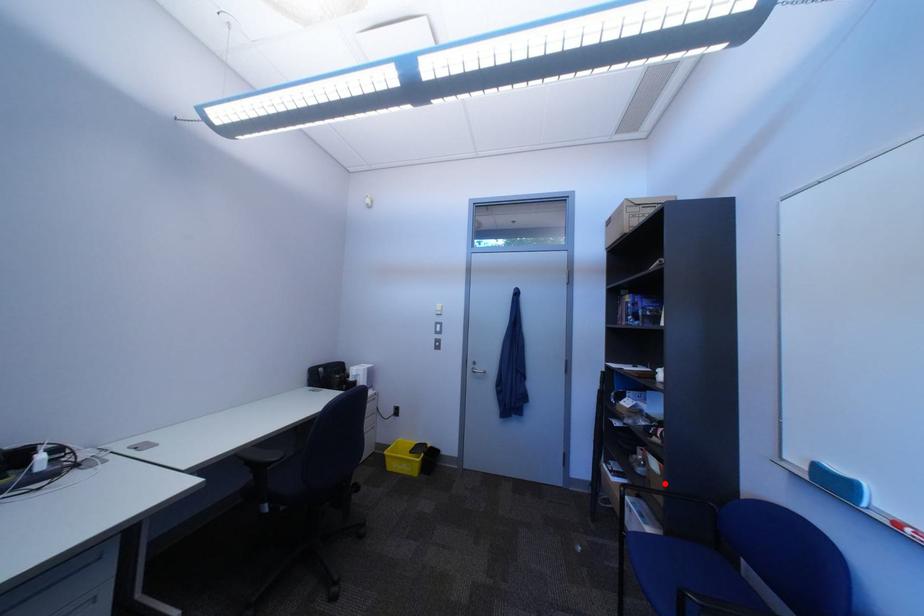
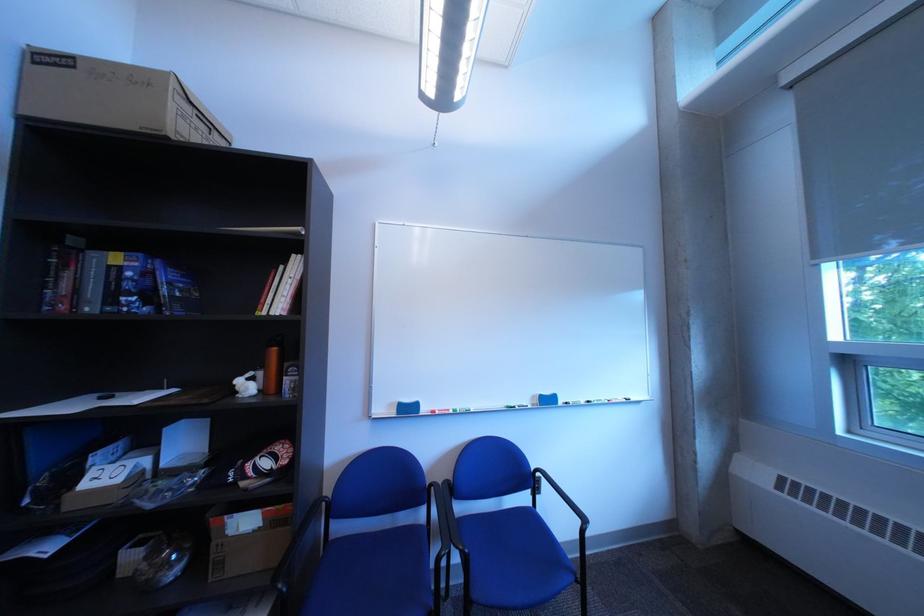
Question: A red point is marked in image1. In image2, is the corresponding 3D point closer to the camera or farther? Reply with the corresponding letter.

Choices:
 (A) The corresponding 3D point is closer.
 (B) The corresponding 3D point is farther.

Answer: (A)